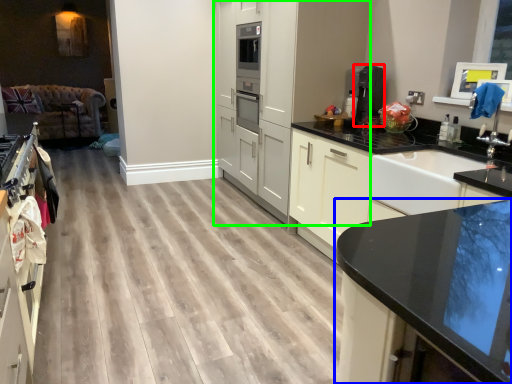
Question: Estimate the real-world distances between objects in this image. Which object is closer to coffee machine (highlighted by a red box), countertop (highlighted by a blue box) or cabinetry (highlighted by a green box)?

Choices:
 (A) countertop
 (B) cabinetry

Answer: (B)